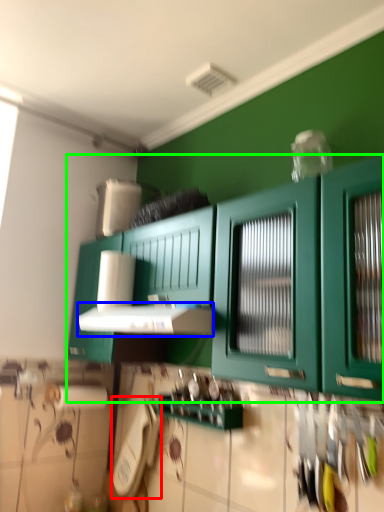
Question: Which object is the closest to the appliance (highlighted by a red box)? Choose among these: vent (highlighted by a blue box) or cabinetry (highlighted by a green box).

Choices:
 (A) vent
 (B) cabinetry

Answer: (A)